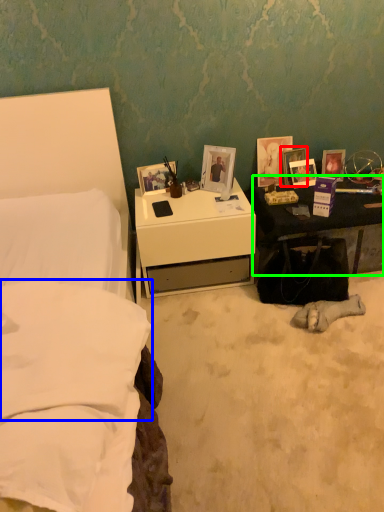
Question: Which object is positioned farthest from picture frame (highlighted by a red box)? Select from pillow (highlighted by a blue box) and nightstand (highlighted by a green box).

Choices:
 (A) pillow
 (B) nightstand

Answer: (A)